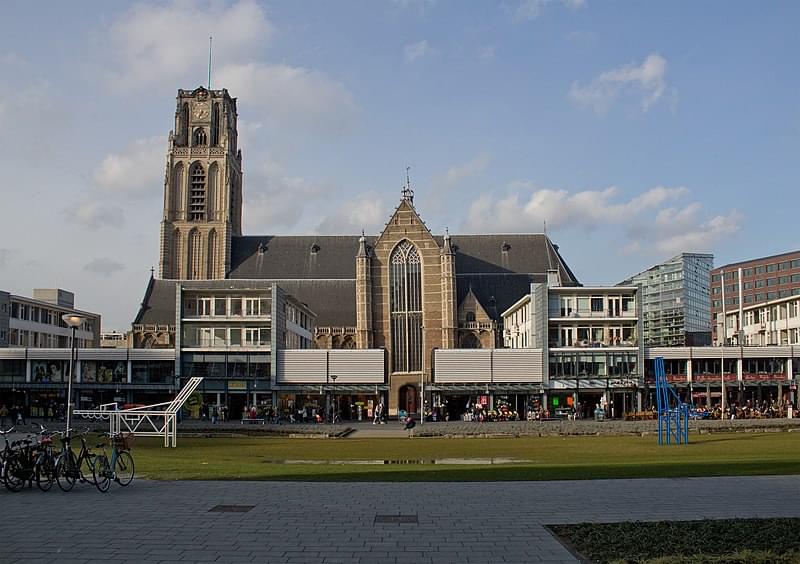
Locate an element on the screen. This screenshot has width=800, height=564. blue frame is located at coordinates (669, 414).